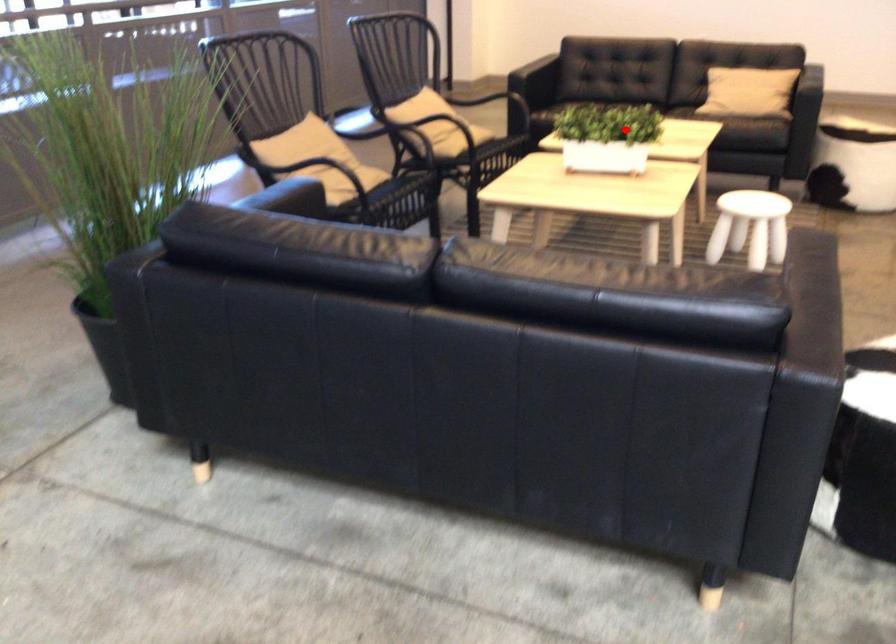
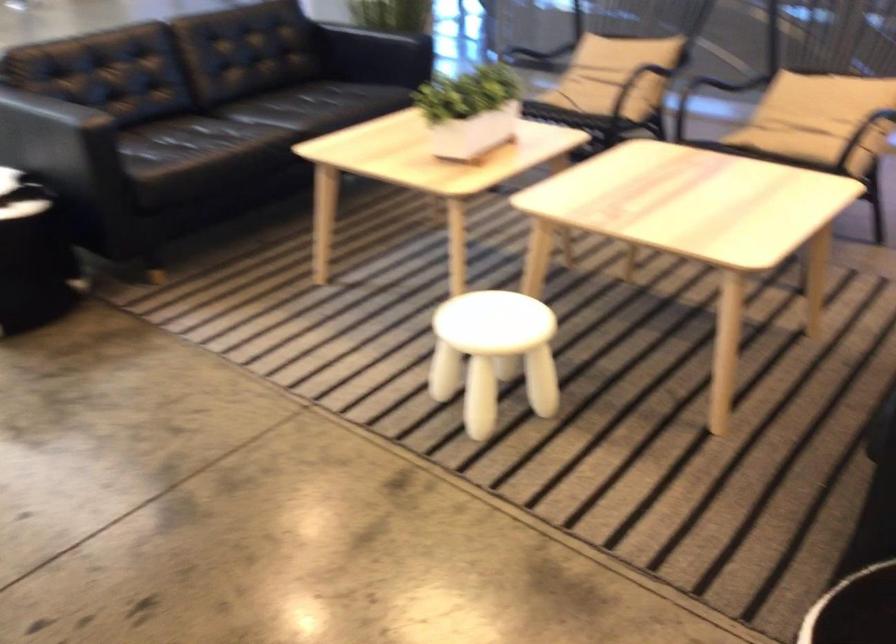
Question: I am providing you with two images of the same scene from different viewpoints. In image1, a red point is highlighted. Considering the same 3D point in image2, which of the following is correct?

Choices:
 (A) It is closer
 (B) It is farther

Answer: (A)